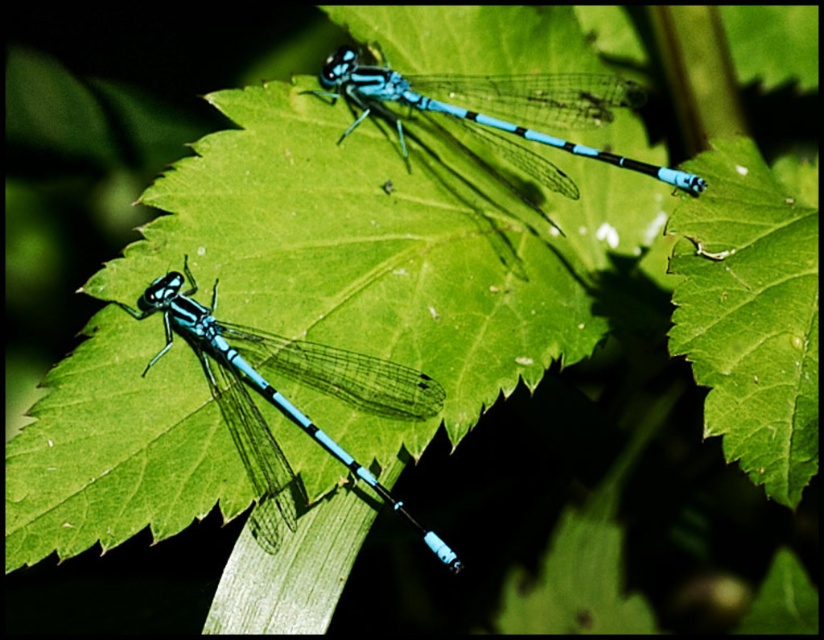
Between green matte leaf at upper right and blue glossy dragonfly at upper center, which one is positioned higher?

blue glossy dragonfly at upper center is higher up.

Image resolution: width=824 pixels, height=640 pixels. Find the location of `green matte leaf at upper right`. green matte leaf at upper right is located at coordinates (748, 314).

Image resolution: width=824 pixels, height=640 pixels. Describe the element at coordinates (286, 397) in the screenshot. I see `translucent blue dragonfly at lower left` at that location.

Measure the distance between translucent blue dragonfly at lower left and camera.

A: translucent blue dragonfly at lower left is 1.25 meters from camera.

Who is more distant from viewer, (314, 435) or (527, 80)?

The point (527, 80) is behind.

Where is `translucent blue dragonfly at lower left`? translucent blue dragonfly at lower left is located at coordinates (286, 397).

Does green matte leaf at upper right lie behind translucent blue dragonfly at lower left?

That is False.

Between green matte leaf at upper right and translucent blue dragonfly at lower left, which one has more height?

Standing taller between the two is green matte leaf at upper right.

Which is in front, point (673, 330) or point (219, 356)?

Point (673, 330)

The image size is (824, 640). I want to click on green matte leaf at upper right, so click(x=748, y=314).